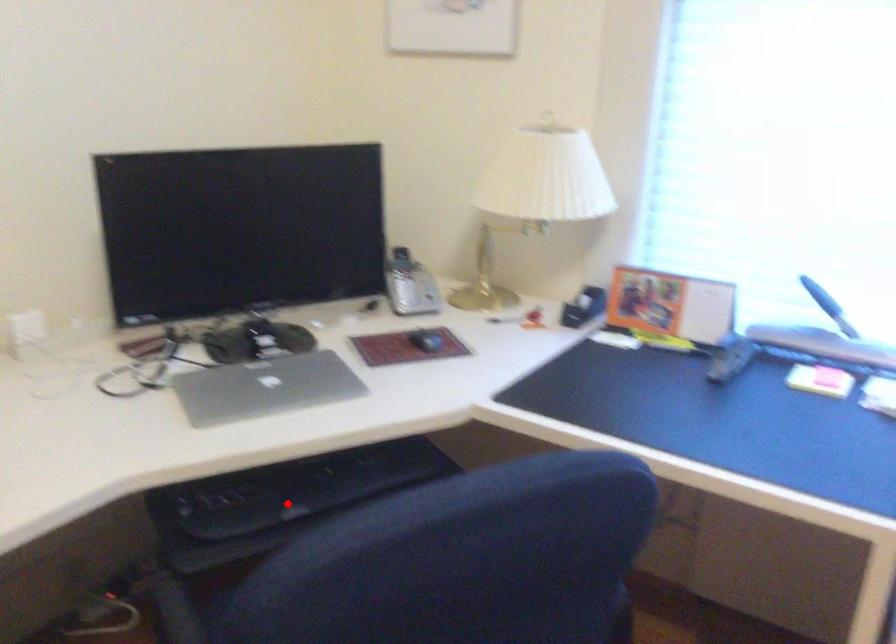
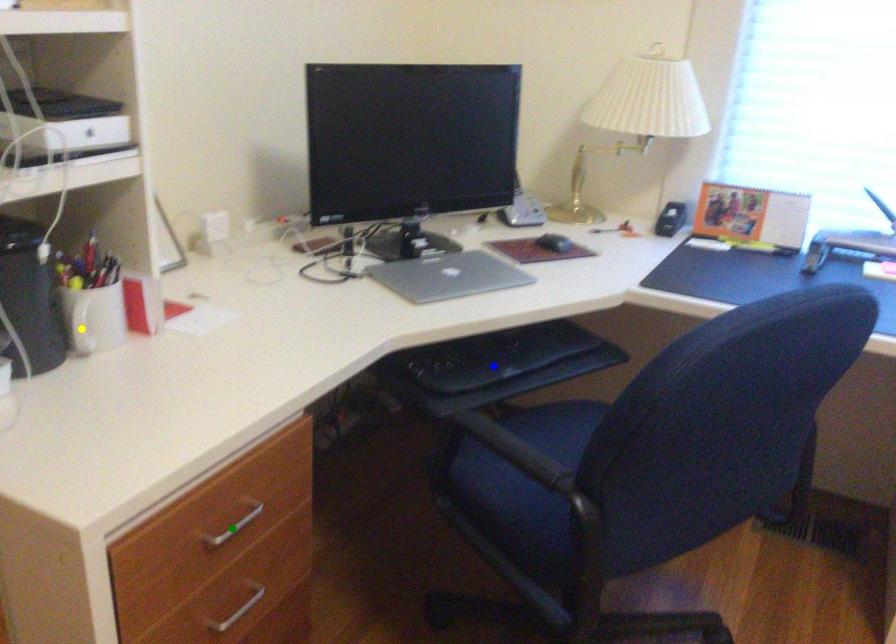
Question: I am providing you with two images of the same scene from different viewpoints. A red point is marked on the first image. You are given multiple points on the second image. In image 2, which mark is for the same physical point as the one in image 1?

Choices:
 (A) blue point
 (B) yellow point
 (C) green point

Answer: (A)